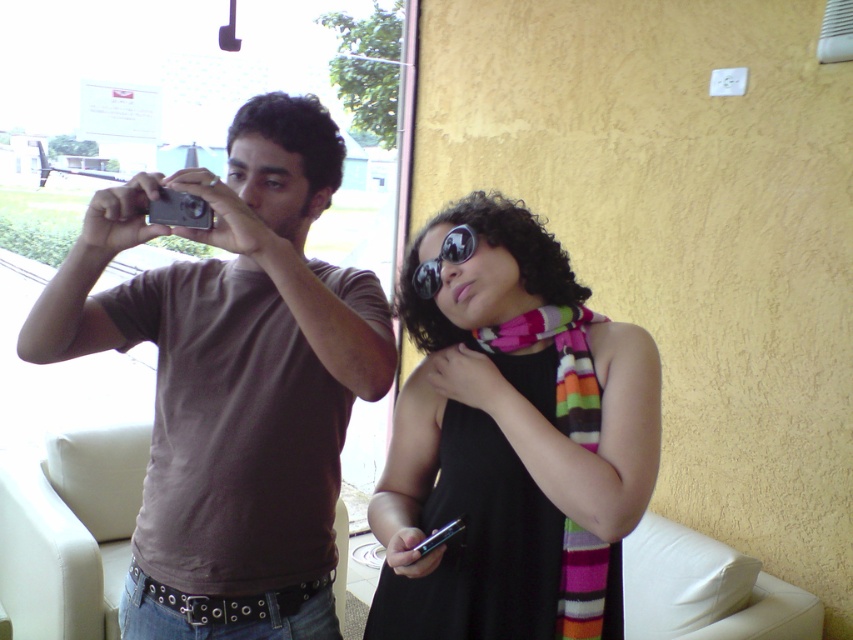
You are a photographer trying to decide whether to place the black reflective sunglasses at center and the silver metallic camera at upper left on a narrow shelf. The shelf can only hold items that are no wider than 12 inches. Which item should you prioritize placing first to ensure both fit?

The silver metallic camera at upper left is narrower than the black reflective sunglasses at center. Since the shelf has limited width, place the wider black reflective sunglasses at center first to ensure both items fit within the 12 inches space.